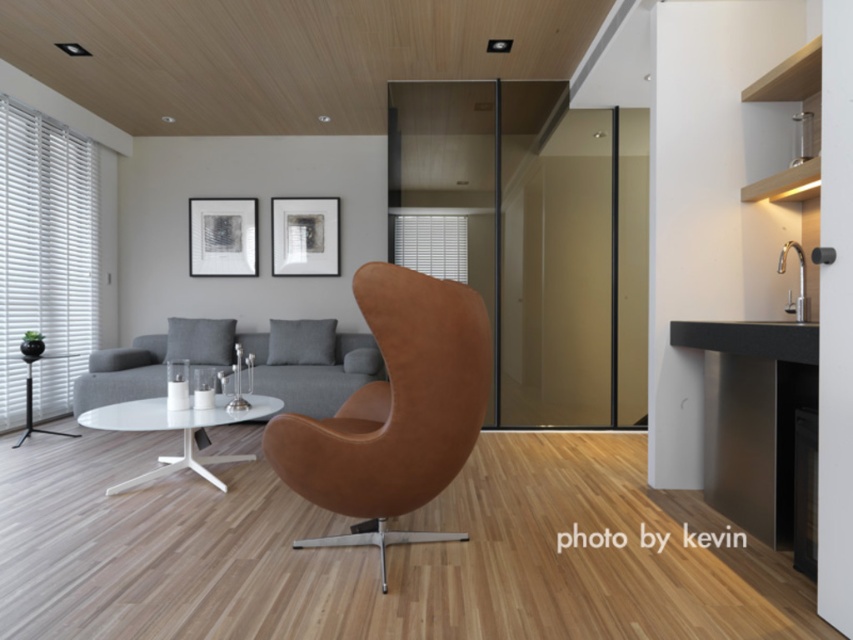
Question: Considering the real-world distances, which object is closest to the transparent glass door at center?

Choices:
 (A) matte white coffee table at center
 (B) tan leather swivel chair at center

Answer: (A)

Question: Is transparent glass door at center to the left of white glossy glass table at center from the viewer's perspective?

Choices:
 (A) yes
 (B) no

Answer: (B)

Question: Based on their relative distances, which object is nearer to the transparent glass door at center?

Choices:
 (A) white glossy glass table at center
 (B) matte white coffee table at center
 (C) tan leather swivel chair at center

Answer: (B)

Question: Which point is farther to the camera?

Choices:
 (A) matte white coffee table at center
 (B) transparent glass door at center

Answer: (B)

Question: Can you confirm if transparent glass door at center is wider than matte white coffee table at center?

Choices:
 (A) no
 (B) yes

Answer: (A)

Question: Does tan leather swivel chair at center have a lesser width compared to white glossy glass table at center?

Choices:
 (A) no
 (B) yes

Answer: (B)